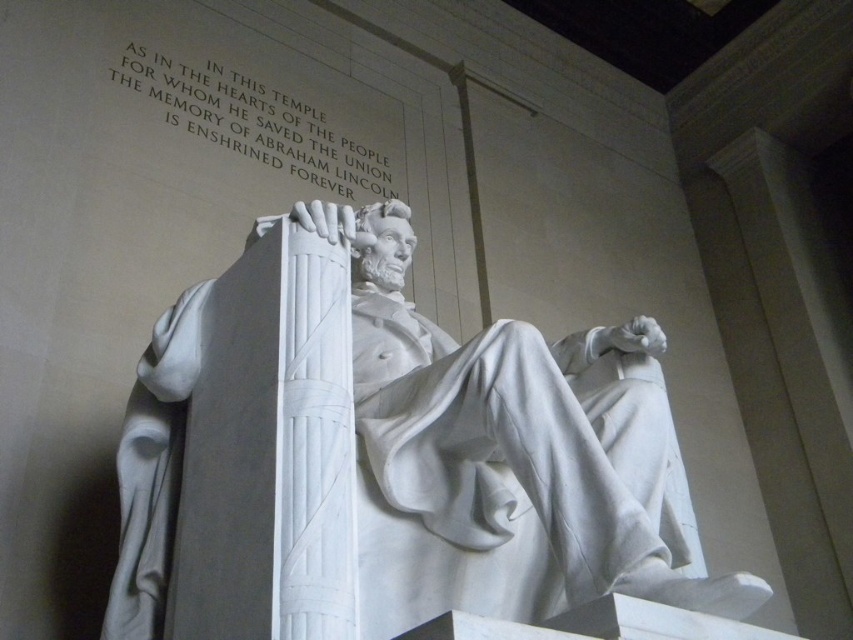
Question: Which object is farther from the camera taking this photo?

Choices:
 (A) white marble text at upper center
 (B) white marble statue at center

Answer: (A)

Question: Does white marble statue at center lie behind white marble text at upper center?

Choices:
 (A) yes
 (B) no

Answer: (B)

Question: Is white marble statue at center thinner than white marble text at upper center?

Choices:
 (A) yes
 (B) no

Answer: (B)

Question: Is white marble statue at center to the right of white marble text at upper center from the viewer's perspective?

Choices:
 (A) no
 (B) yes

Answer: (B)

Question: Among these points, which one is farthest from the camera?

Choices:
 (A) (352, 280)
 (B) (373, 138)

Answer: (B)